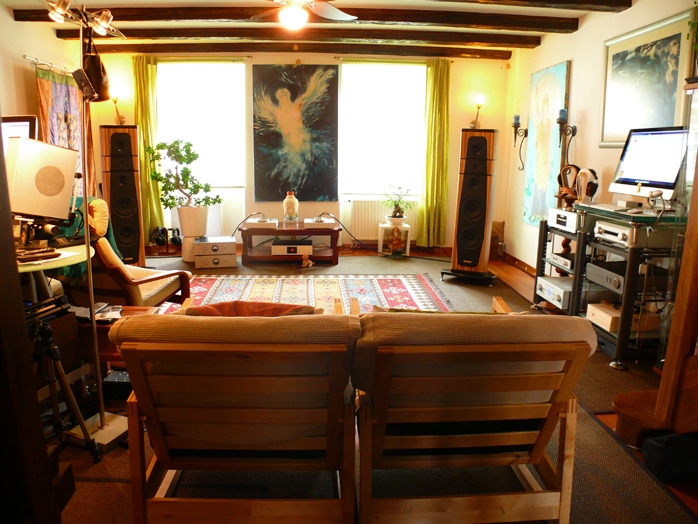
Locate an element on the screen. The width and height of the screenshot is (698, 524). canvas is located at coordinates (255, 70), (533, 80).